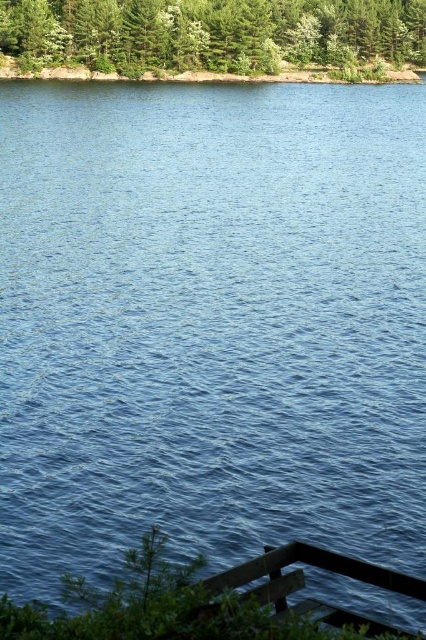
Question: Among these points, which one is farthest from the camera?

Choices:
 (A) (293, 561)
 (B) (17, 54)

Answer: (B)

Question: Does green leafy trees at upper center have a smaller size compared to wooden dock at lower right?

Choices:
 (A) no
 (B) yes

Answer: (A)

Question: Can you confirm if green leafy trees at upper center is smaller than wooden dock at lower right?

Choices:
 (A) yes
 (B) no

Answer: (B)

Question: Is green leafy trees at upper center below wooden dock at lower right?

Choices:
 (A) yes
 (B) no

Answer: (B)

Question: Which object appears closest to the camera in this image?

Choices:
 (A) green leafy trees at upper center
 (B) wooden dock at lower right

Answer: (B)

Question: Which of the following is the farthest from the observer?

Choices:
 (A) wooden dock at lower right
 (B) green leafy trees at upper center

Answer: (B)